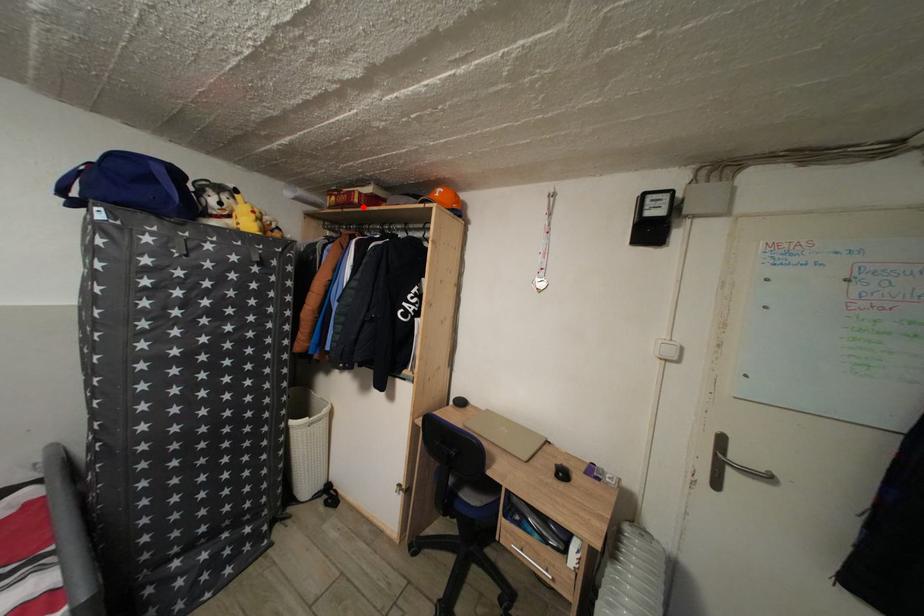
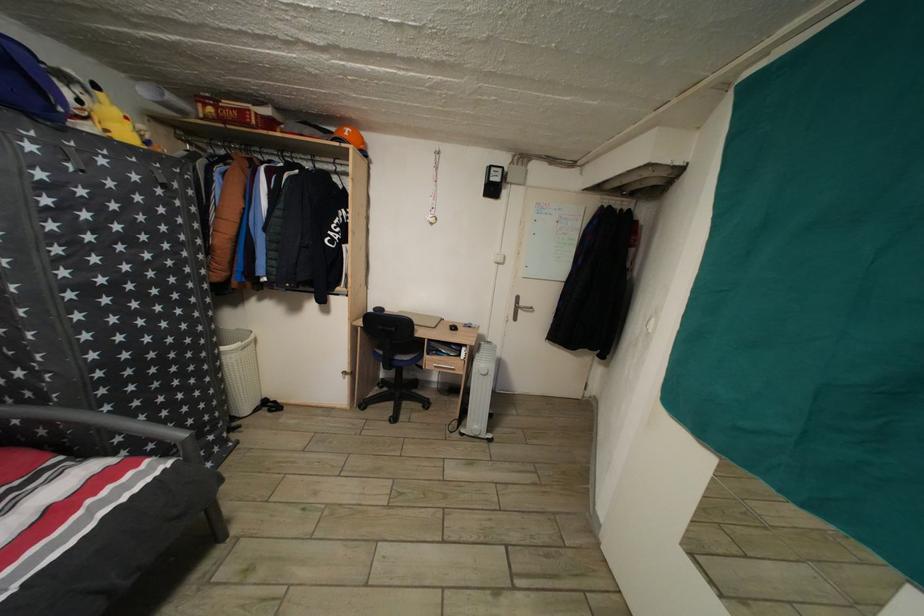
Find the pixel in the second image that matches the highlighted location in the first image.

(261, 129)